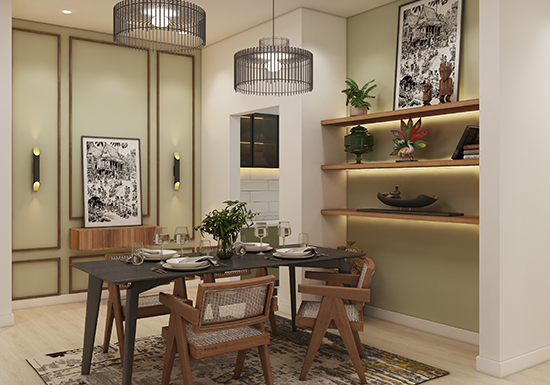
The height and width of the screenshot is (385, 550). In order to click on shelf lighting in this screenshot , I will do `click(443, 228)`, `click(444, 174)`, `click(448, 120)`.